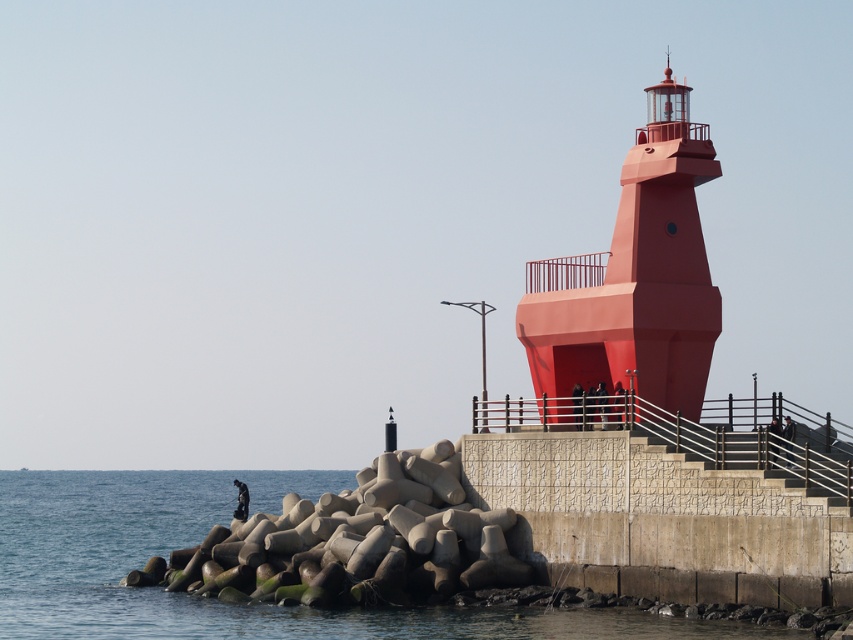
Does transparent water at lower left come behind blue concrete water at lower left?

No.

Is point (68, 516) closer to camera compared to point (102, 538)?

No, it is not.

Measure the distance between transparent water at lower left and camera.

transparent water at lower left is 57.75 meters from camera.

Locate an element on the screen. Image resolution: width=853 pixels, height=640 pixels. transparent water at lower left is located at coordinates (213, 598).

Measure the distance between point [178,625] and camera.

A distance of 226.55 feet exists between point [178,625] and camera.

Measure the distance between point (424, 611) and camera.

Point (424, 611) and camera are 66.35 meters apart.

Identify the location of transparent water at lower left. (213, 598).

Can you confirm if blue concrete water at lower left is positioned to the left of matte red tower at center?

Yes, blue concrete water at lower left is to the left of matte red tower at center.

The height and width of the screenshot is (640, 853). In order to click on blue concrete water at lower left in this screenshot , I will do `click(125, 560)`.